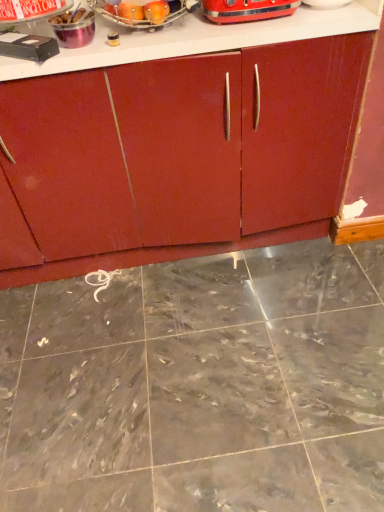
Question: Which direction should I rotate to look at shiny metallic toaster at upper center, the fifth appliance when ordered from left to right, — up or down?

Choices:
 (A) up
 (B) down

Answer: (A)

Question: Is shiny metallic toaster at upper center, the fifth appliance when ordered from left to right, facing towards gray marble floor at center?

Choices:
 (A) yes
 (B) no

Answer: (B)

Question: Would you say shiny metallic toaster at upper center, the fifth appliance when ordered from left to right, contains gray marble floor at center?

Choices:
 (A) yes
 (B) no

Answer: (B)

Question: Can you confirm if shiny metallic toaster at upper center, the fifth appliance when ordered from left to right, is positioned to the right of gray marble floor at center?

Choices:
 (A) no
 (B) yes

Answer: (B)

Question: Is shiny metallic toaster at upper center, the fifth appliance when ordered from left to right, at the left side of gray marble floor at center?

Choices:
 (A) yes
 (B) no

Answer: (B)

Question: From a real-world perspective, is shiny metallic toaster at upper center, arranged as the first appliance when viewed from the right, positioned over gray marble floor at center based on gravity?

Choices:
 (A) no
 (B) yes

Answer: (B)

Question: Is the depth of shiny metallic toaster at upper center, the fifth appliance when ordered from left to right, less than that of gray marble floor at center?

Choices:
 (A) no
 (B) yes

Answer: (A)

Question: Considering the relative sizes of metallic silver toaster at upper center, arranged as the second appliance when viewed from the left, and matte wood cabinet at center in the image provided, is metallic silver toaster at upper center, arranged as the second appliance when viewed from the left, shorter than matte wood cabinet at center?

Choices:
 (A) yes
 (B) no

Answer: (A)

Question: Is metallic silver toaster at upper center, arranged as the second appliance when viewed from the left, positioned beyond the bounds of matte wood cabinet at center?

Choices:
 (A) no
 (B) yes

Answer: (B)

Question: Is metallic silver toaster at upper center, arranged as the second appliance when viewed from the left, smaller than matte wood cabinet at center?

Choices:
 (A) yes
 (B) no

Answer: (A)

Question: Can you see metallic silver toaster at upper center, which is counted as the fourth appliance, starting from the right, touching matte wood cabinet at center?

Choices:
 (A) no
 (B) yes

Answer: (A)

Question: Can you confirm if metallic silver toaster at upper center, which is counted as the fourth appliance, starting from the right, is bigger than matte wood cabinet at center?

Choices:
 (A) no
 (B) yes

Answer: (A)

Question: Considering the relative sizes of metallic silver toaster at upper center, which is counted as the fourth appliance, starting from the right, and matte wood cabinet at center in the image provided, is metallic silver toaster at upper center, which is counted as the fourth appliance, starting from the right, wider than matte wood cabinet at center?

Choices:
 (A) no
 (B) yes

Answer: (A)

Question: Is there a large distance between metallic silver container at upper left, which ranks as the third appliance in right-to-left order, and metallic silver toaster at upper center, which is counted as the fourth appliance, starting from the right?

Choices:
 (A) yes
 (B) no

Answer: (B)